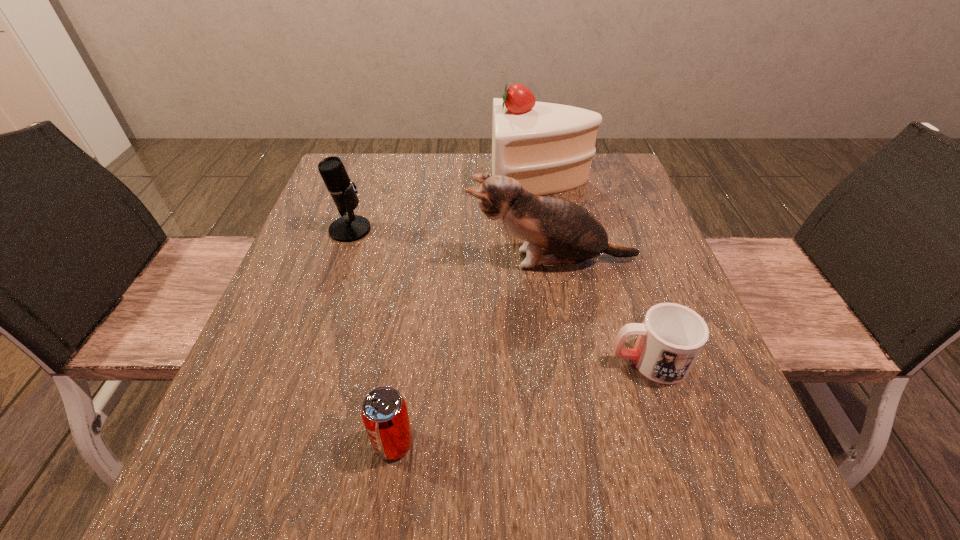
Select which object appears as the closest to the mug. Please provide its 2D coordinates. Your answer should be formatted as a tuple, i.e. [(x, y)], where the tuple contains the x and y coordinates of a point satisfying the conditions above.

[(556, 231)]

This screenshot has height=540, width=960. What are the coordinates of `vacant space that satisfies the following two spatial constraints: 1. on the front side of the fourth tallest object; 2. on the left side of the microphone` in the screenshot? It's located at (276, 443).